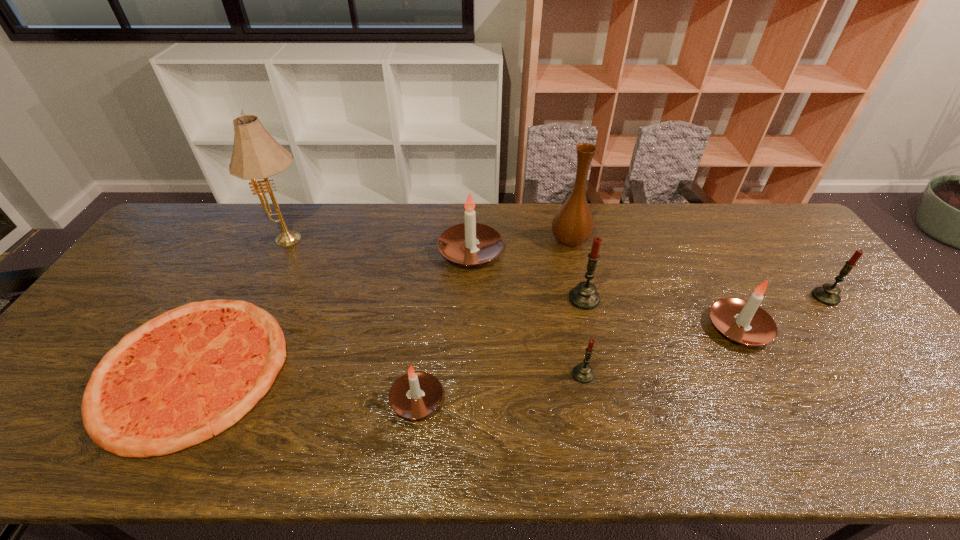
Find the location of a particular element. vacant position located on the left of the second nearest white candle is located at coordinates pyautogui.click(x=634, y=328).

This screenshot has height=540, width=960. Find the location of `vacant space located on the front of the smallest red candle`. vacant space located on the front of the smallest red candle is located at coordinates (595, 435).

The height and width of the screenshot is (540, 960). I want to click on vacant space located on the back of the smallest white candle, so click(430, 285).

Find the location of `free location located 0.400m on the back of the shortest object`. free location located 0.400m on the back of the shortest object is located at coordinates (276, 219).

Where is `lampshade at the far edge`? Image resolution: width=960 pixels, height=540 pixels. lampshade at the far edge is located at coordinates (256, 154).

Locate an element on the screen. This screenshot has height=540, width=960. vase positioned at the far edge is located at coordinates (573, 225).

At what (x,y) coordinates should I click in order to perform the action: click on candle located at the far edge. Please return your answer as a coordinate pair (x, y). This screenshot has height=540, width=960. Looking at the image, I should click on (458, 243).

Find the location of a particular element. The image size is (960, 540). candle located in the near edge section of the desktop is located at coordinates (414, 395).

At what (x,y) coordinates should I click in order to perform the action: click on pizza situated at the near edge. Please return your answer as a coordinate pair (x, y). Looking at the image, I should click on (185, 376).

You are a GUI agent. You are given a task and a screenshot of the screen. Output one action in this format:
    pyautogui.click(x=<x>, y=<y>)
    Task: Click on the object located at the left edge
    
    Given the screenshot: What is the action you would take?
    pyautogui.click(x=185, y=376)